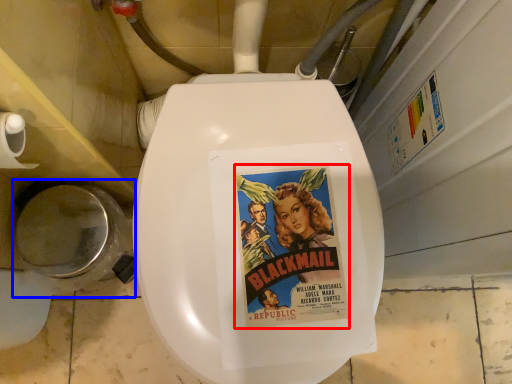
Question: Which object appears farthest to the camera in this image, fiction book (highlighted by a red box) or toilet bowl (highlighted by a blue box)?

Choices:
 (A) fiction book
 (B) toilet bowl

Answer: (B)